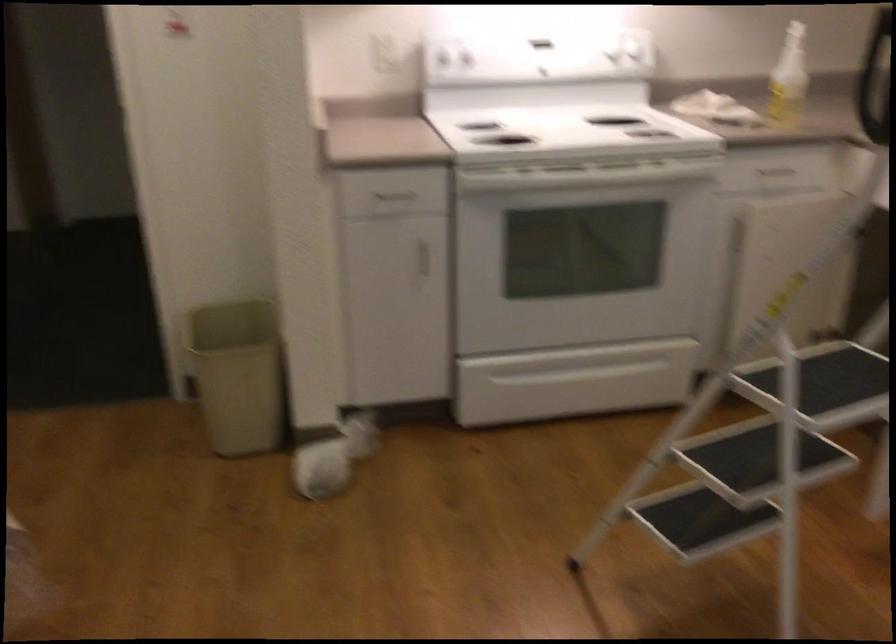
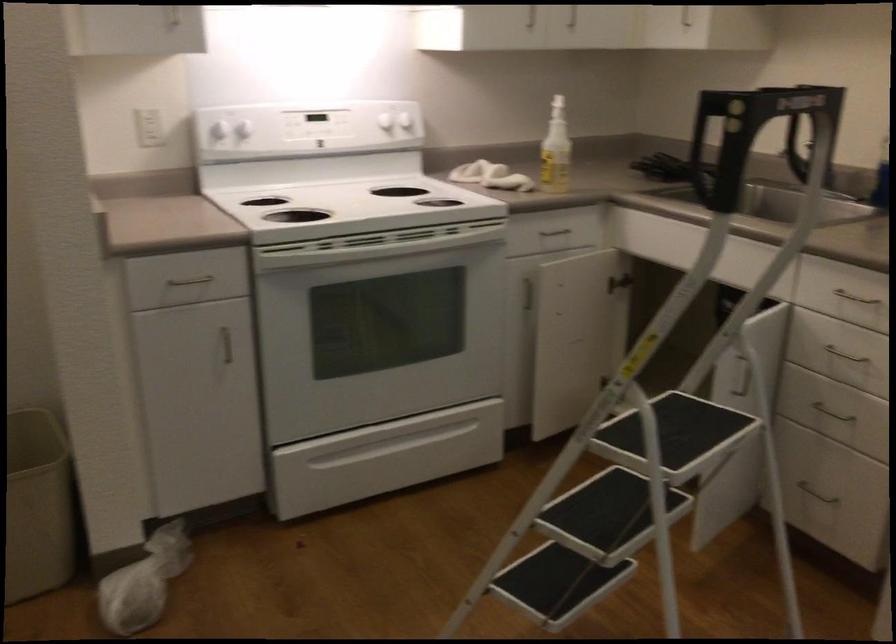
The point at (602, 365) is marked in the first image. Where is the corresponding point in the second image?

(416, 433)